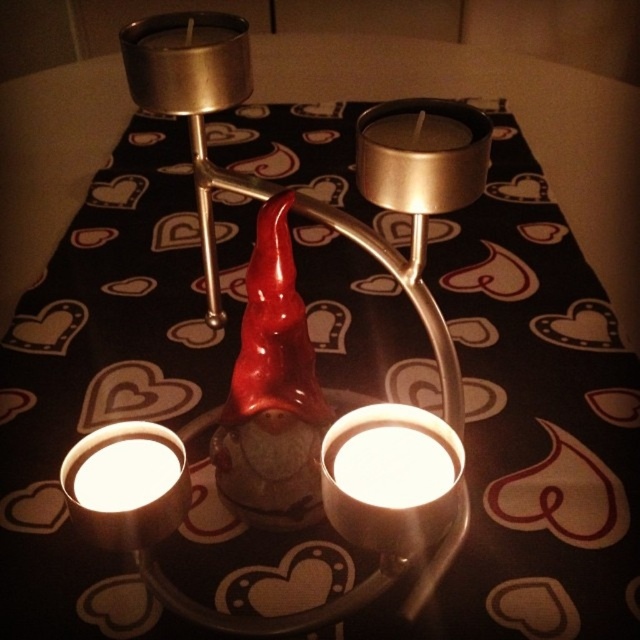
What do you see at coordinates (422, 154) in the screenshot? I see `matte silver candle at upper center` at bounding box center [422, 154].

Is matte silver candle at upper center closer to camera compared to white matte candle at lower left?

That is True.

Based on the photo, who is more forward, (484, 173) or (108, 515)?

Point (108, 515) is in front.

Identify the location of matte silver candle at upper center. (422, 154).

Which is more to the right, matte silver candle at upper center or brushed metal candle at upper center?

matte silver candle at upper center

Is matte silver candle at upper center thinner than brushed metal candle at upper center?

Correct, matte silver candle at upper center's width is less than brushed metal candle at upper center's.

The width and height of the screenshot is (640, 640). What are the coordinates of `matte silver candle at upper center` in the screenshot? It's located at (422, 154).

Can you confirm if brushed metal candle holder at center is positioned to the left of white matte candle at lower left?

In fact, brushed metal candle holder at center is to the right of white matte candle at lower left.

Does brushed metal candle holder at center have a smaller size compared to white matte candle at lower left?

Actually, brushed metal candle holder at center might be larger than white matte candle at lower left.

Is point (412, 477) farther from camera compared to point (168, 529)?

That is True.

Where is `brushed metal candle holder at center`? The height and width of the screenshot is (640, 640). brushed metal candle holder at center is located at coordinates (390, 477).